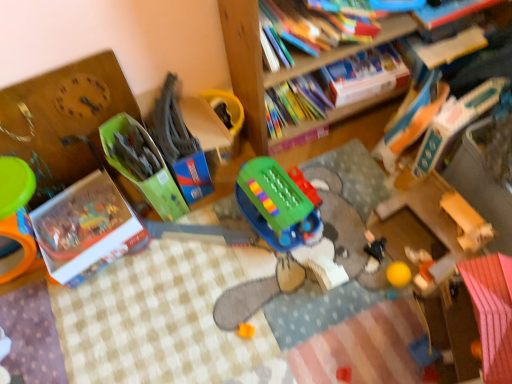
Where is `vacant space that is to the left of black plastic toy at center, the 2th toy positioned from the right`? vacant space that is to the left of black plastic toy at center, the 2th toy positioned from the right is located at coordinates (335, 251).